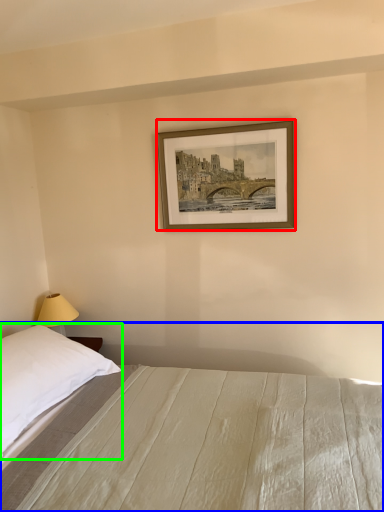
Question: Which object is the closest to the picture frame (highlighted by a red box)? Choose among these: bed (highlighted by a blue box) or pillow (highlighted by a green box).

Choices:
 (A) bed
 (B) pillow

Answer: (A)